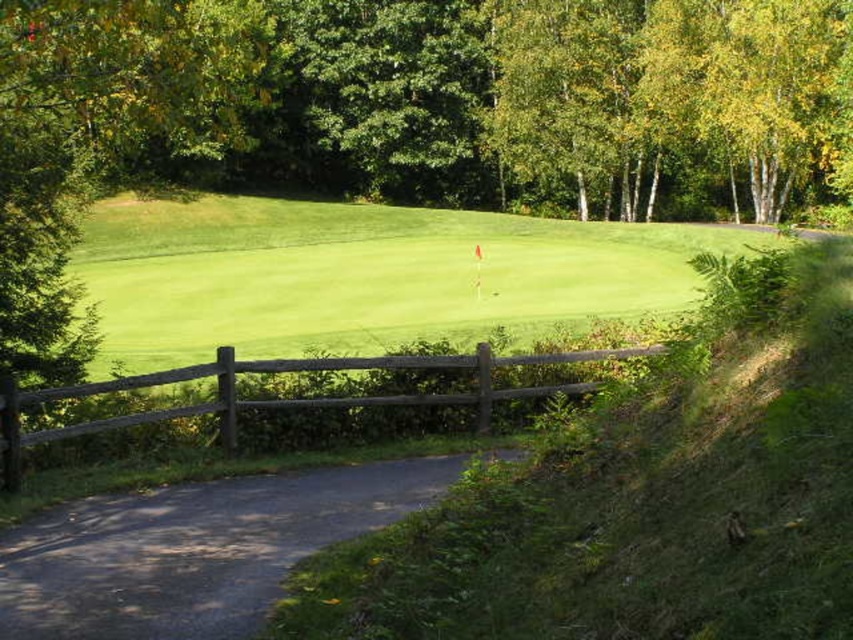
Can you confirm if green grassy golf course at center is positioned to the right of brown wooden fence at center?

Indeed, green grassy golf course at center is positioned on the right side of brown wooden fence at center.

Is green grassy golf course at center taller than brown wooden fence at center?

Correct, green grassy golf course at center is much taller as brown wooden fence at center.

You are a GUI agent. You are given a task and a screenshot of the screen. Output one action in this format:
    pyautogui.click(x=<x>, y=<y>)
    Task: Click on the green grassy golf course at center
    The height and width of the screenshot is (640, 853).
    Given the screenshot: What is the action you would take?
    pyautogui.click(x=364, y=275)

Between green grassy golf course at center and dark gray asphalt road at lower left, which one is positioned higher?

green grassy golf course at center is above.

Between point (102, 227) and point (219, 596), which one is positioned in front?

Point (219, 596)

Where is `green grassy golf course at center`? This screenshot has width=853, height=640. green grassy golf course at center is located at coordinates (364, 275).

Is point (160, 492) positioned after point (189, 376)?

No, it is in front of (189, 376).

Between point (212, 582) and point (480, 422), which one is positioned in front?

Point (212, 582) is more forward.

Where is `dark gray asphalt road at lower left`? This screenshot has width=853, height=640. dark gray asphalt road at lower left is located at coordinates [x=194, y=548].

You are a GUI agent. You are given a task and a screenshot of the screen. Output one action in this format:
    pyautogui.click(x=<x>, y=<y>)
    Task: Click on the dark gray asphalt road at lower left
    
    Given the screenshot: What is the action you would take?
    pyautogui.click(x=194, y=548)